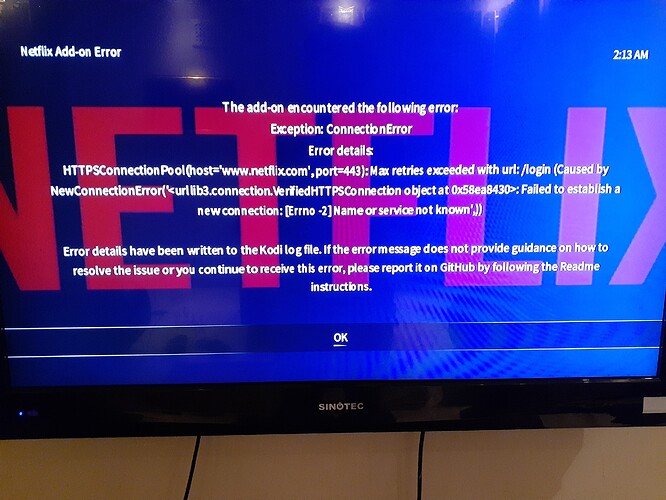
Where is `television frame`? Image resolution: width=666 pixels, height=500 pixels. television frame is located at coordinates (400, 402).